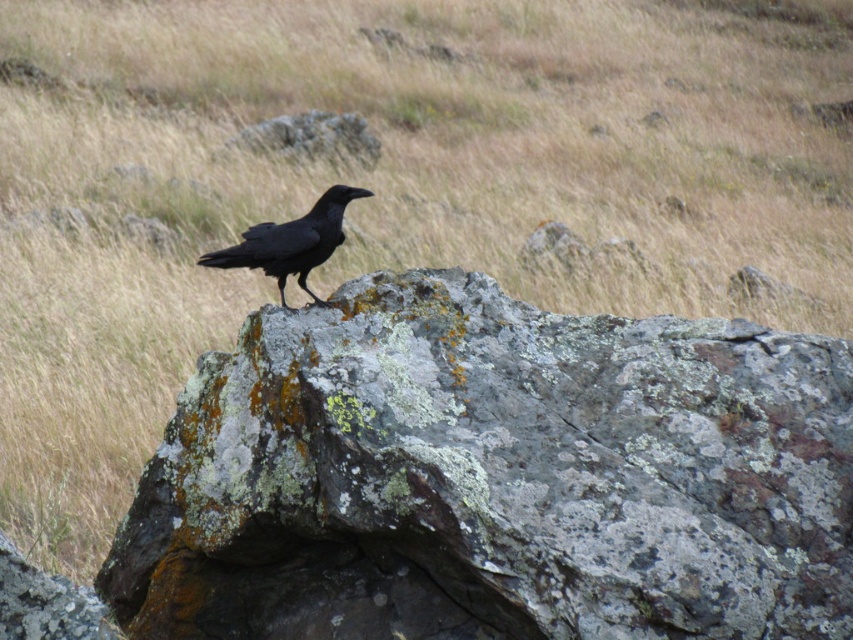
Question: Is lichen-covered rock at center further to the viewer compared to shiny black raven at center?

Choices:
 (A) yes
 (B) no

Answer: (B)

Question: Does lichen-covered rock at center have a larger size compared to shiny black raven at center?

Choices:
 (A) yes
 (B) no

Answer: (A)

Question: Which point is farther to the camera?

Choices:
 (A) (300, 216)
 (B) (190, 445)

Answer: (A)

Question: Which point is farther to the camera?

Choices:
 (A) shiny black raven at center
 (B) lichen-covered rock at center

Answer: (A)

Question: Is lichen-covered rock at center to the right of shiny black raven at center from the viewer's perspective?

Choices:
 (A) yes
 (B) no

Answer: (A)

Question: Which point is closer to the camera?

Choices:
 (A) (305, 401)
 (B) (265, 240)

Answer: (A)